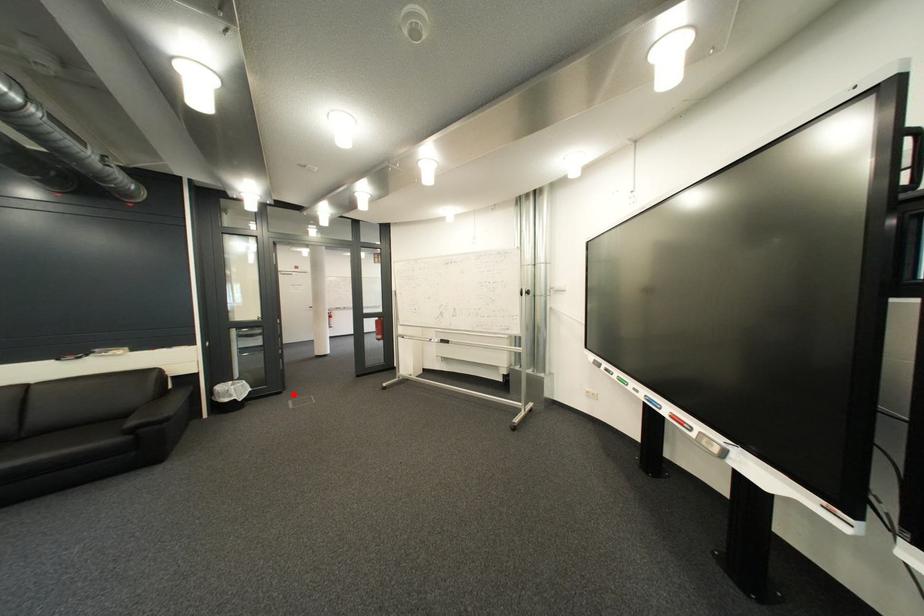
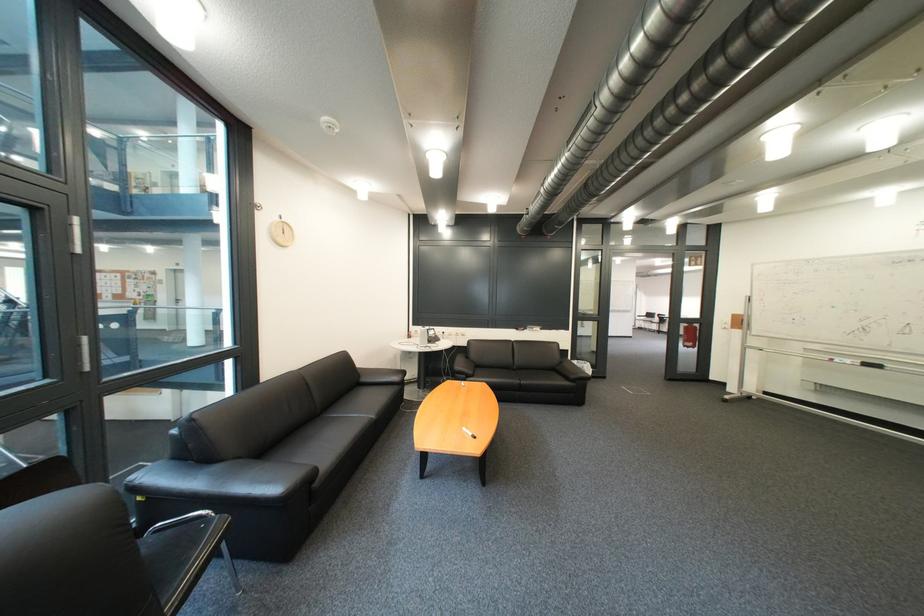
Where in the second image is the point corresponding to the highlighted location from the first image?

(618, 379)